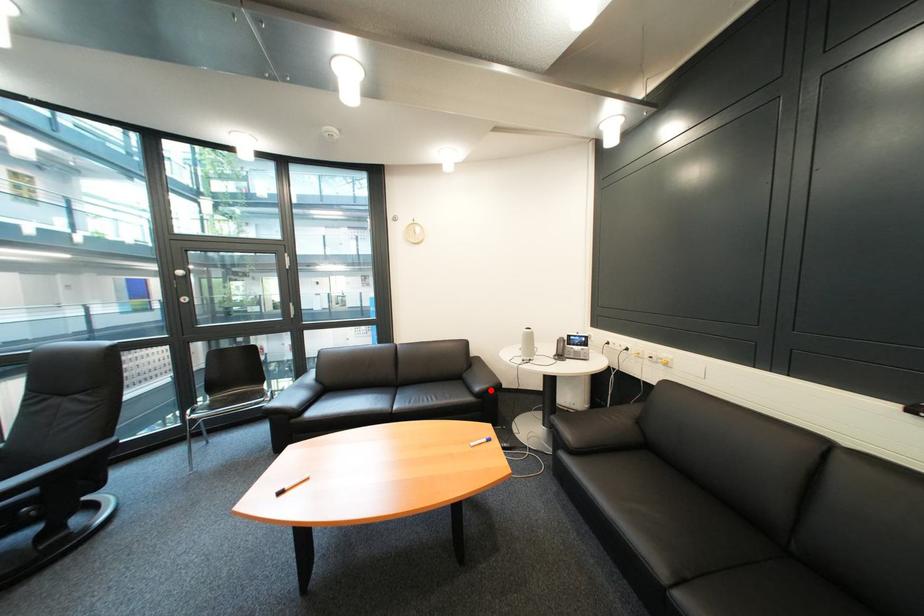
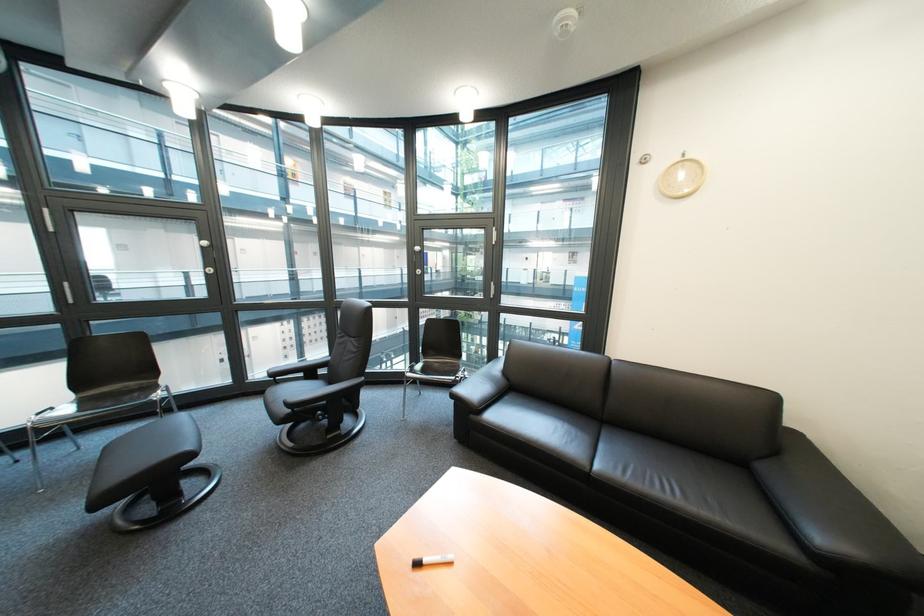
Question: A red point is marked in image1. In image2, is the corresponding 3D point closer to the camera or farther? Reply with the corresponding letter.

Choices:
 (A) The corresponding 3D point is closer.
 (B) The corresponding 3D point is farther.

Answer: (A)